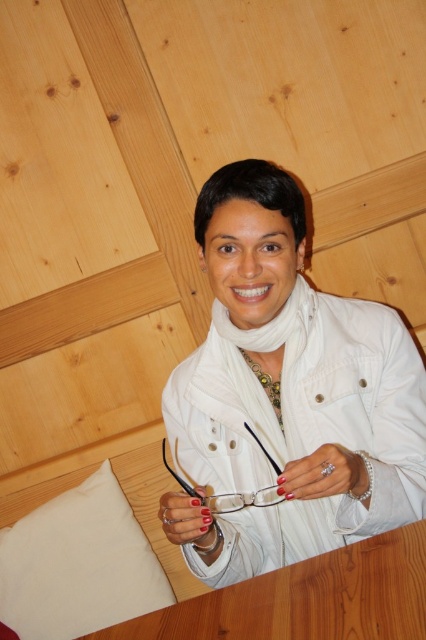
Question: Is wooden table at center to the right of white fabric pillow at lower left from the viewer's perspective?

Choices:
 (A) no
 (B) yes

Answer: (B)

Question: Which of the following is the farthest from the observer?

Choices:
 (A) white matte jacket at center
 (B) wooden table at center
 (C) nail polish at center

Answer: (A)

Question: Is wooden table at center positioned behind nail polish at center?

Choices:
 (A) no
 (B) yes

Answer: (A)

Question: Which object is closer to the camera taking this photo?

Choices:
 (A) white fabric pillow at lower left
 (B) pearl bracelet at lower center
 (C) nail polish at center
 (D) white matte jacket at center

Answer: (B)

Question: Which point is farther to the camera?

Choices:
 (A) (287, 474)
 (B) (74, 509)
 (C) (221, 314)

Answer: (B)

Question: From the image, what is the correct spatial relationship of white matte jacket at center in relation to pearl bracelet at lower center?

Choices:
 (A) below
 (B) above

Answer: (B)